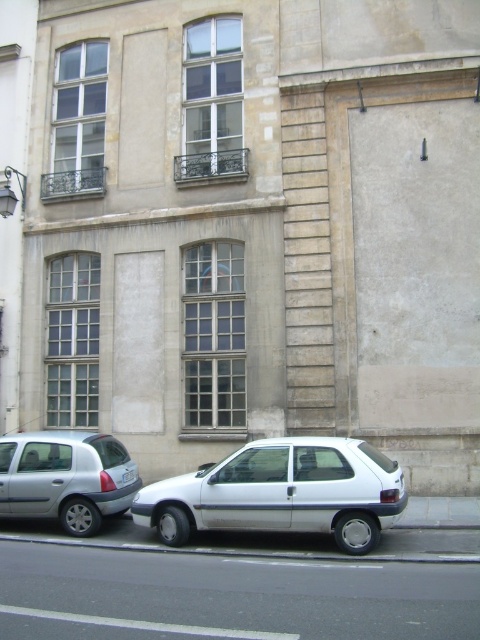
In the scene shown: You are a delivery person standing in front of the building and need to park your van between the two cars. The van is 5 meters long. Can you fit it between the white matte hatchback at center and the white plastic license plate at lower center?

The white matte hatchback at center is to the right of the white plastic license plate at lower center, but the distance between them isn

You are a delivery driver who needs to park your vehicle in a space that can only accommodate vehicles smaller than the white plastic license plate at lower center. Can the white matte hatchback at center fit in that parking space?

The white matte hatchback at center is bigger than the white plastic license plate at lower center, so it cannot fit in the parking space designed for vehicles smaller than the license plate.

You are standing in front of the building and notice the gray concrete curb at lower center and the white plastic license plate at lower center. Which object is nearer to you?

The gray concrete curb at lower center is closer to the viewer than the white plastic license plate at lower center.